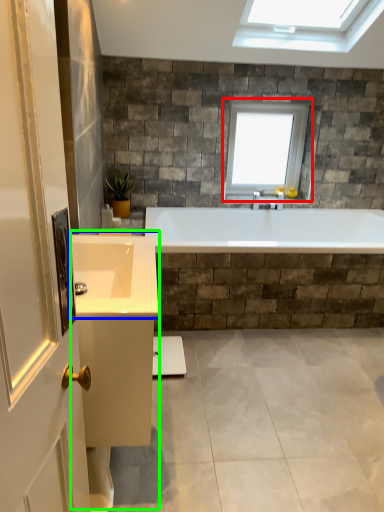
Question: Considering the real-world distances, which object is closest to window (highlighted by a red box)? sink (highlighted by a blue box) or vanity (highlighted by a green box).

Choices:
 (A) sink
 (B) vanity

Answer: (A)